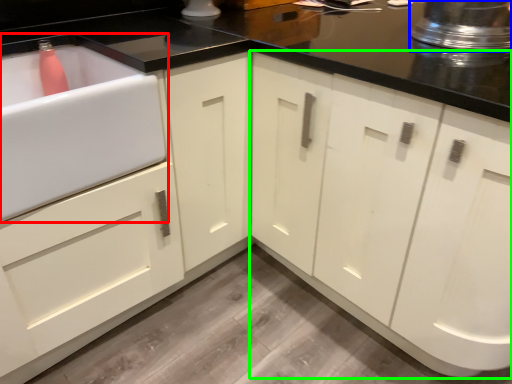
Question: Which object is the farthest from sink (highlighted by a red box)? Choose among these: appliance (highlighted by a blue box) or cabinetry (highlighted by a green box).

Choices:
 (A) appliance
 (B) cabinetry

Answer: (A)